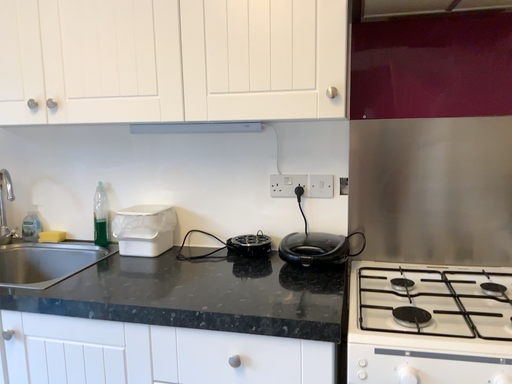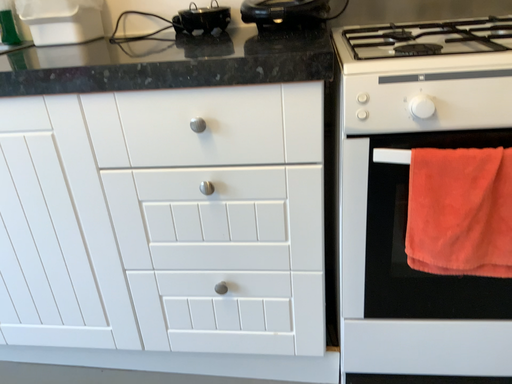
Question: How did the camera likely rotate when shooting the video?

Choices:
 (A) rotated right
 (B) rotated left

Answer: (A)